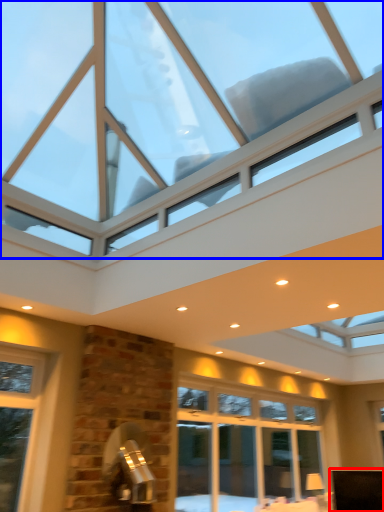
Question: Which object appears closest to the camera in this image, furniture (highlighted by a red box) or window (highlighted by a blue box)?

Choices:
 (A) furniture
 (B) window

Answer: (B)